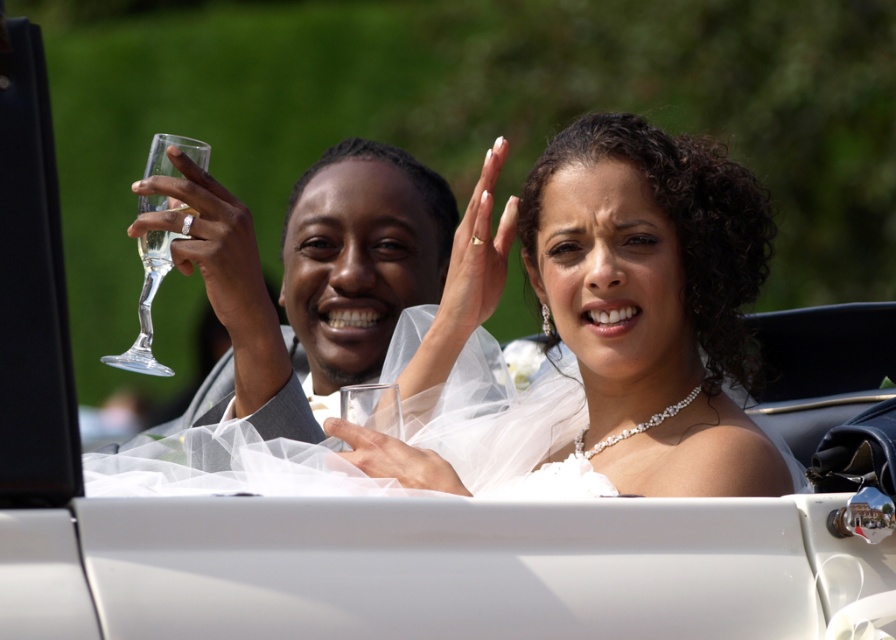
Question: Which of the following is the farthest from the observer?

Choices:
 (A) 642,307
 (B) 342,228

Answer: (B)

Question: Which object is closer to the camera taking this photo?

Choices:
 (A) clear glass wine glass at upper left
 (B) clear glass flute at upper left

Answer: (A)

Question: Estimate the real-world distances between objects in this image. Which object is farther from the pearl necklace at center?

Choices:
 (A) clear glass wine glass at upper left
 (B) clear glass flute at upper left

Answer: (B)

Question: Does pearl necklace at center have a smaller size compared to clear glass flute at upper left?

Choices:
 (A) no
 (B) yes

Answer: (B)

Question: Does pearl necklace at center appear over clear glass wine glass at upper left?

Choices:
 (A) no
 (B) yes

Answer: (A)

Question: Is pearl necklace at center to the left of clear glass flute at upper left from the viewer's perspective?

Choices:
 (A) no
 (B) yes

Answer: (A)